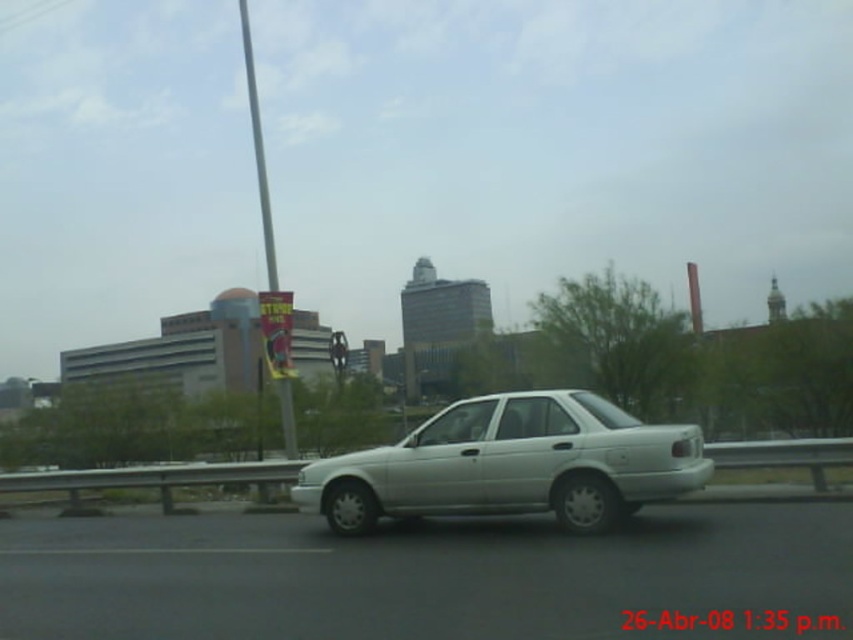
Question: Is white metallic car at center smaller than metallic pole at center?

Choices:
 (A) yes
 (B) no

Answer: (A)

Question: Can you confirm if white metallic car at center is bigger than white matte sedan at center?

Choices:
 (A) no
 (B) yes

Answer: (B)

Question: Which object is farther from the camera taking this photo?

Choices:
 (A) white matte sedan at center
 (B) white metallic car at center
 (C) metallic pole at center

Answer: (C)

Question: Which point is closer to the camera?

Choices:
 (A) (190, 540)
 (B) (558, 435)
 (C) (286, 401)

Answer: (B)

Question: Can you confirm if white matte sedan at center is smaller than metallic pole at center?

Choices:
 (A) yes
 (B) no

Answer: (A)

Question: Among these points, which one is farthest from the camera?

Choices:
 (A) (260, 209)
 (B) (364, 556)

Answer: (A)